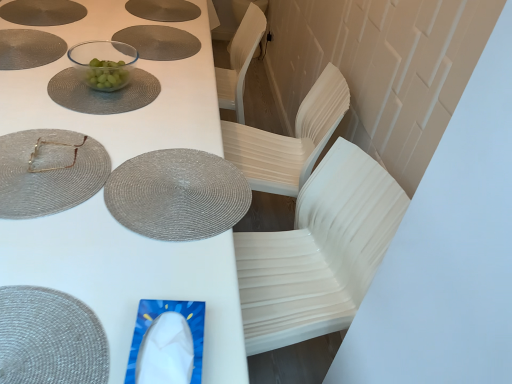
This screenshot has width=512, height=384. I want to click on vacant space that's between matte silver placemat at upper left, the 2th platter viewed from the right, and silver textured placemat at center, which is the second tableware from front to back, so click(x=74, y=71).